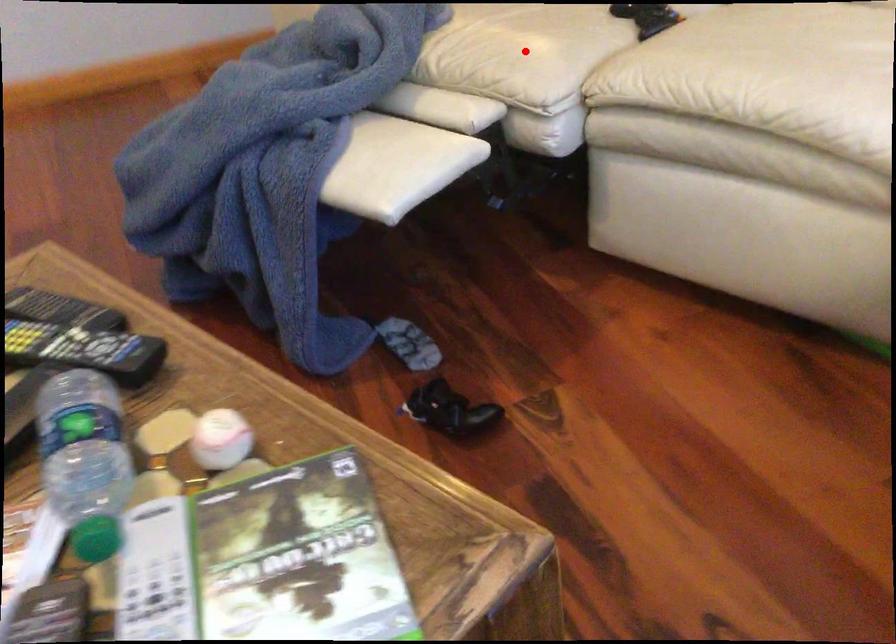
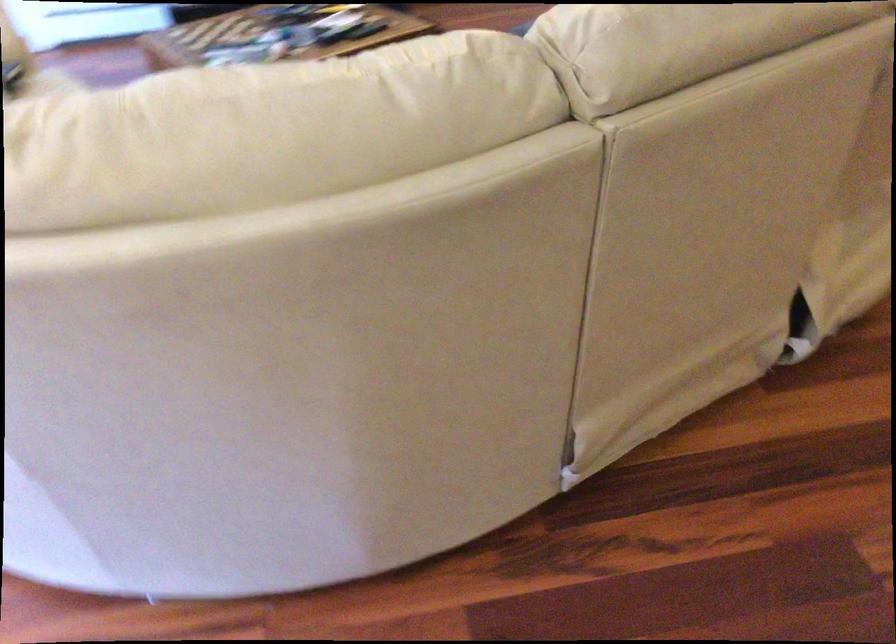
Question: I am providing you with two images of the same scene from different viewpoints. A red point is marked on the first image. Is the red point's position out of view in image 2?

Choices:
 (A) Yes
 (B) No

Answer: (A)